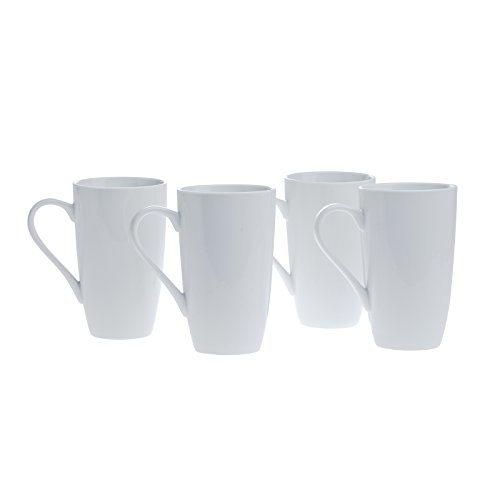
The height and width of the screenshot is (500, 500). I want to click on handles, so click(33, 229), click(131, 226), click(280, 265), click(330, 257).